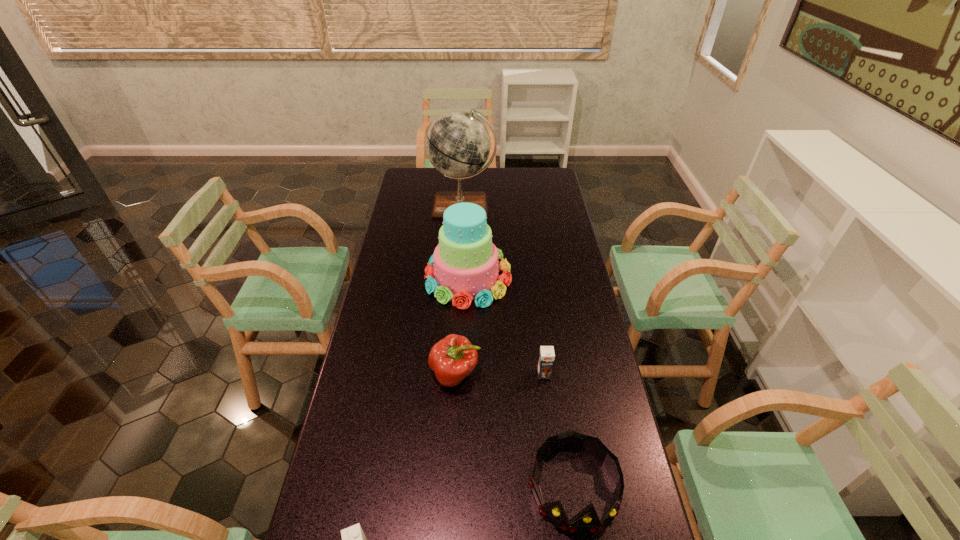
This screenshot has width=960, height=540. I want to click on vacant region located 0.290m on the front label of the farther chocolate milk, so click(558, 475).

This screenshot has height=540, width=960. Find the location of `object present at the far edge`. object present at the far edge is located at coordinates (458, 144).

Locate an element on the screen. The width and height of the screenshot is (960, 540). object that is at the left edge is located at coordinates (458, 144).

Where is `object at the right edge`? The image size is (960, 540). object at the right edge is located at coordinates (587, 520).

At what (x,y) coordinates should I click in order to perform the action: click on object located at the far left corner. Please return your answer as a coordinate pair (x, y). Looking at the image, I should click on (458, 144).

Where is `free space at the far edge of the desktop`? Image resolution: width=960 pixels, height=540 pixels. free space at the far edge of the desktop is located at coordinates (457, 183).

Image resolution: width=960 pixels, height=540 pixels. In the image, there is a desktop. Identify the location of vacant area at the left edge. pos(336,518).

The width and height of the screenshot is (960, 540). I want to click on free space at the right edge, so (x=575, y=417).

Locate an element on the screen. vacant space at the far right corner of the desktop is located at coordinates (539, 176).

Where is `vacant space in between the tiara and the tallest object`? vacant space in between the tiara and the tallest object is located at coordinates (518, 347).